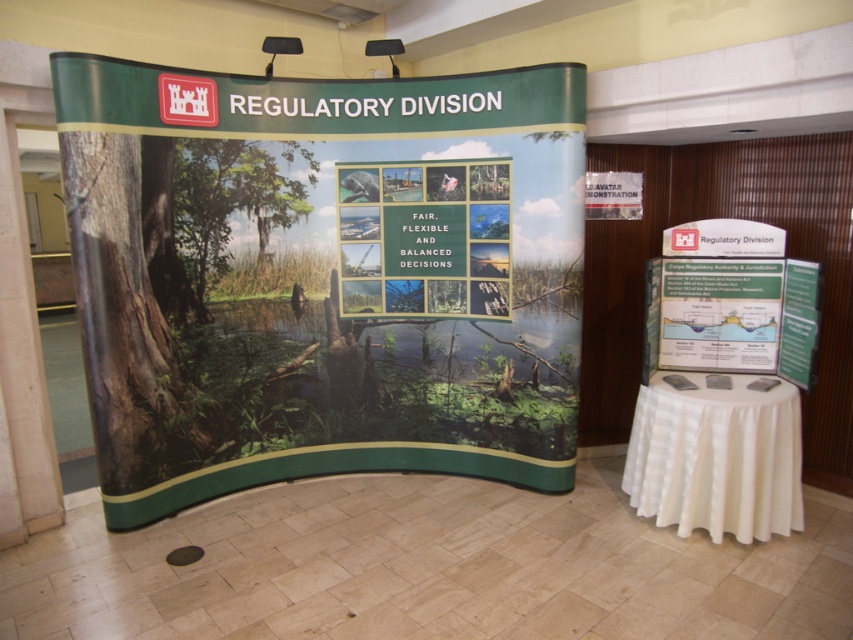
Question: Does matte green poster at center come in front of white cloth-covered table at lower right?

Choices:
 (A) no
 (B) yes

Answer: (B)

Question: Which object appears closest to the camera in this image?

Choices:
 (A) white cloth-covered table at lower right
 (B) matte green poster at center

Answer: (B)

Question: Can you confirm if matte green poster at center is smaller than white cloth-covered table at lower right?

Choices:
 (A) no
 (B) yes

Answer: (A)

Question: Which of the following is the farthest from the observer?

Choices:
 (A) (671, 449)
 (B) (344, 272)

Answer: (B)

Question: Can you confirm if matte green poster at center is smaller than white cloth-covered table at lower right?

Choices:
 (A) no
 (B) yes

Answer: (A)

Question: Which point appears closest to the camera in this image?

Choices:
 (A) (682, 497)
 (B) (322, 170)

Answer: (A)